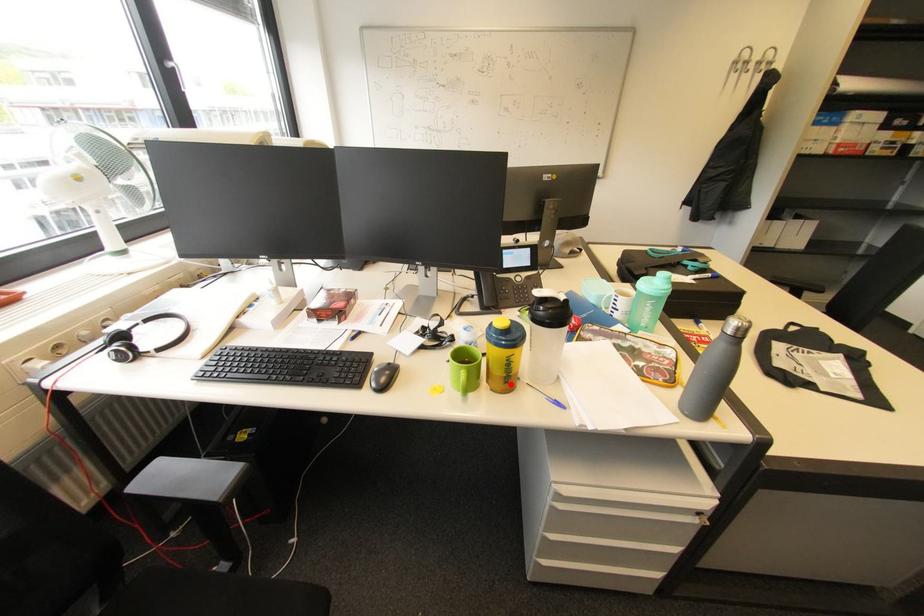
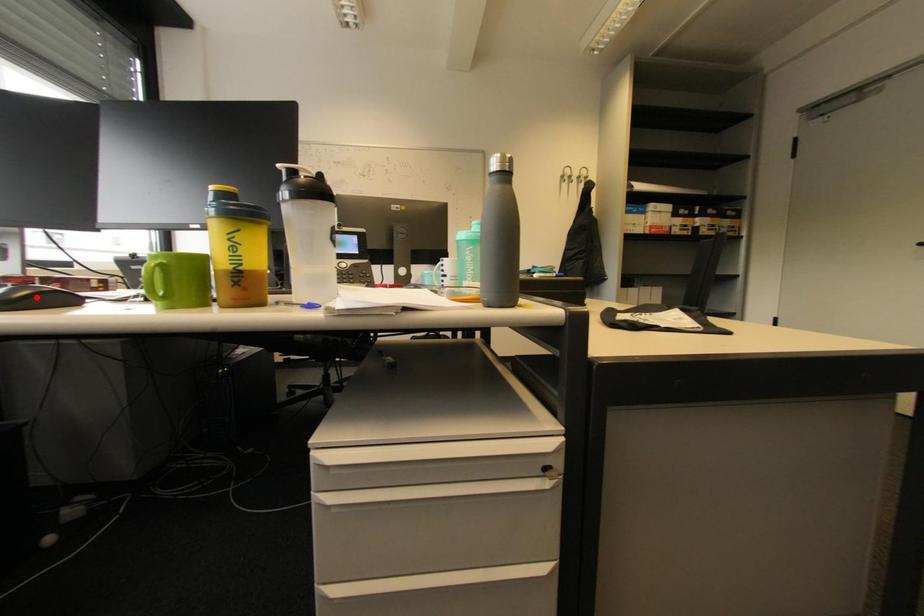
I am providing you with two images of the same scene from different viewpoints. A red point is marked on the first image and another point is marked on the second image. Is the red point in image1 aligned with the point shown in image2?

No